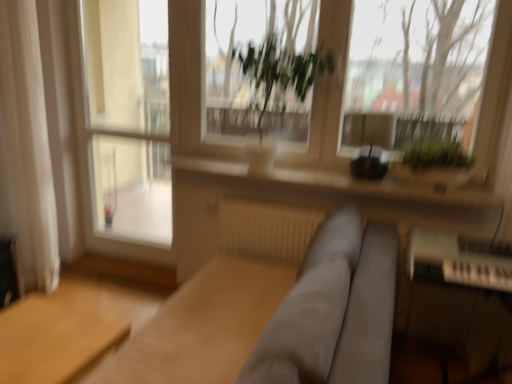
Question: From a real-world perspective, is light brown wooden table at lower left on top of white fabric curtain at left?

Choices:
 (A) no
 (B) yes

Answer: (A)

Question: Is light brown wooden table at lower left further to the viewer compared to white fabric curtain at left?

Choices:
 (A) yes
 (B) no

Answer: (B)

Question: Does light brown wooden table at lower left lie in front of white fabric curtain at left?

Choices:
 (A) no
 (B) yes

Answer: (B)

Question: Can you confirm if light brown wooden table at lower left is wider than white fabric curtain at left?

Choices:
 (A) yes
 (B) no

Answer: (A)

Question: Is light brown wooden table at lower left facing away from white fabric curtain at left?

Choices:
 (A) no
 (B) yes

Answer: (A)

Question: Can you confirm if light brown wooden table at lower left is thinner than white fabric curtain at left?

Choices:
 (A) yes
 (B) no

Answer: (B)

Question: Is gray fabric couch at center beside light brown wooden table at lower left?

Choices:
 (A) no
 (B) yes

Answer: (A)

Question: Is gray fabric couch at center facing towards light brown wooden table at lower left?

Choices:
 (A) yes
 (B) no

Answer: (A)

Question: Does gray fabric couch at center have a lesser width compared to light brown wooden table at lower left?

Choices:
 (A) yes
 (B) no

Answer: (A)

Question: From a real-world perspective, is gray fabric couch at center positioned over light brown wooden table at lower left based on gravity?

Choices:
 (A) no
 (B) yes

Answer: (B)

Question: Is gray fabric couch at center far away from light brown wooden table at lower left?

Choices:
 (A) yes
 (B) no

Answer: (B)

Question: Can you confirm if gray fabric couch at center is taller than light brown wooden table at lower left?

Choices:
 (A) no
 (B) yes

Answer: (B)

Question: Is light brown wooden table at lower left further to the viewer compared to green leafy plant at center, marked as the first vegetation in a left-to-right arrangement?

Choices:
 (A) yes
 (B) no

Answer: (B)